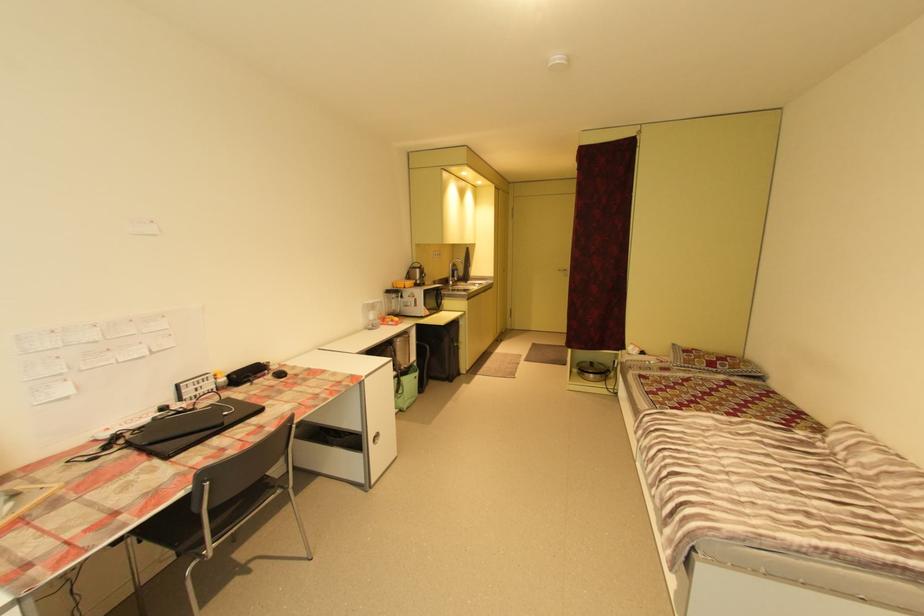
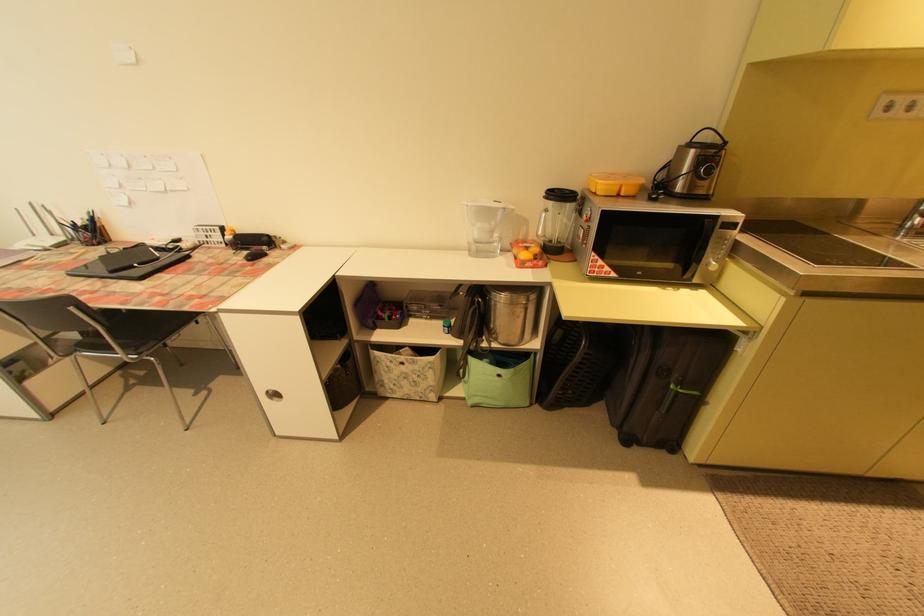
Question: I am providing you with two images of the same scene from different viewpoints. After the viewpoint changes to image2, which objects are now occluded?

Choices:
 (A) patterned storage basket
 (B) orange fruit
 (C) water pitcher handle
 (D) none of these

Answer: (D)